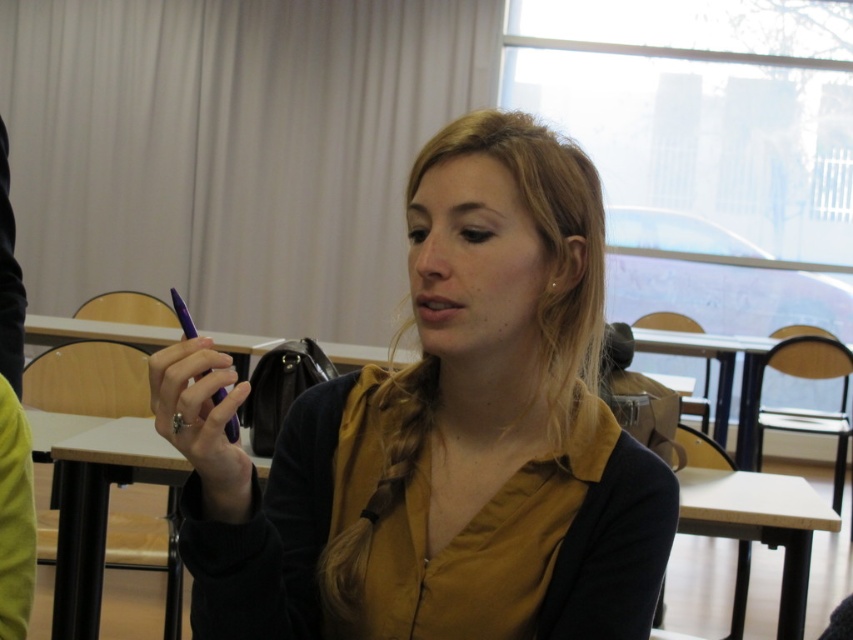
You are a student in the classroom and you need to choose between the matte purple pen at center and the purple glossy pen at center. Which pen is positioned lower?

The matte purple pen at center is located below the purple glossy pen at center, so the matte purple pen at center is positioned lower.

What are the coordinates of the matte purple pen at center?

The coordinates of the matte purple pen at center are at point (x=440, y=436).